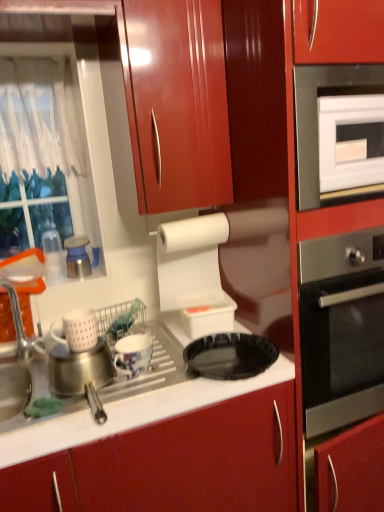
Question: Is green sponge at sink to the right of white plastic container at upper center, which is the fifth appliance in left-to-right order, from the viewer's perspective?

Choices:
 (A) no
 (B) yes

Answer: (A)

Question: Is green sponge at sink at the left side of white plastic container at upper center, the first appliance positioned from the right?

Choices:
 (A) no
 (B) yes

Answer: (B)

Question: Is there a large distance between green sponge at sink and white plastic container at upper center, the first appliance positioned from the right?

Choices:
 (A) no
 (B) yes

Answer: (A)

Question: From the image's perspective, is green sponge at sink under white plastic container at upper center, the first appliance positioned from the right?

Choices:
 (A) yes
 (B) no

Answer: (A)

Question: Are green sponge at sink and white plastic container at upper center, which is the fifth appliance in left-to-right order, beside each other?

Choices:
 (A) no
 (B) yes

Answer: (A)

Question: Does green sponge at sink turn towards white plastic container at upper center, the first appliance positioned from the right?

Choices:
 (A) yes
 (B) no

Answer: (B)

Question: Considering the relative sizes of clear plastic cups at left, which appears as the 5th appliance when viewed from the right, and porcelain floral mug at center, which is the fourth appliance in left-to-right order, in the image provided, is clear plastic cups at left, which appears as the 5th appliance when viewed from the right, smaller than porcelain floral mug at center, which is the fourth appliance in left-to-right order,?

Choices:
 (A) no
 (B) yes

Answer: (A)

Question: Is clear plastic cups at left, which appears as the 5th appliance when viewed from the right, oriented towards porcelain floral mug at center, the 2th appliance from the right?

Choices:
 (A) no
 (B) yes

Answer: (B)

Question: Is porcelain floral mug at center, the 2th appliance from the right, located within clear plastic cups at left, which appears as the 5th appliance when viewed from the right?

Choices:
 (A) yes
 (B) no

Answer: (B)

Question: Is the position of clear plastic cups at left, which appears as the 5th appliance when viewed from the right, less distant than that of porcelain floral mug at center, which is the fourth appliance in left-to-right order?

Choices:
 (A) no
 (B) yes

Answer: (A)

Question: From a real-world perspective, is clear plastic cups at left, which appears as the 5th appliance when viewed from the right, positioned over porcelain floral mug at center, the 2th appliance from the right, based on gravity?

Choices:
 (A) no
 (B) yes

Answer: (B)

Question: Is clear plastic cups at left, marked as the 1th appliance in a left-to-right arrangement, looking in the opposite direction of porcelain floral mug at center, the 2th appliance from the right?

Choices:
 (A) no
 (B) yes

Answer: (A)

Question: Can you confirm if metallic blue and white kettle at left, which is the 2th appliance from left to right, is positioned to the right of white glossy oven at upper right?

Choices:
 (A) yes
 (B) no

Answer: (B)